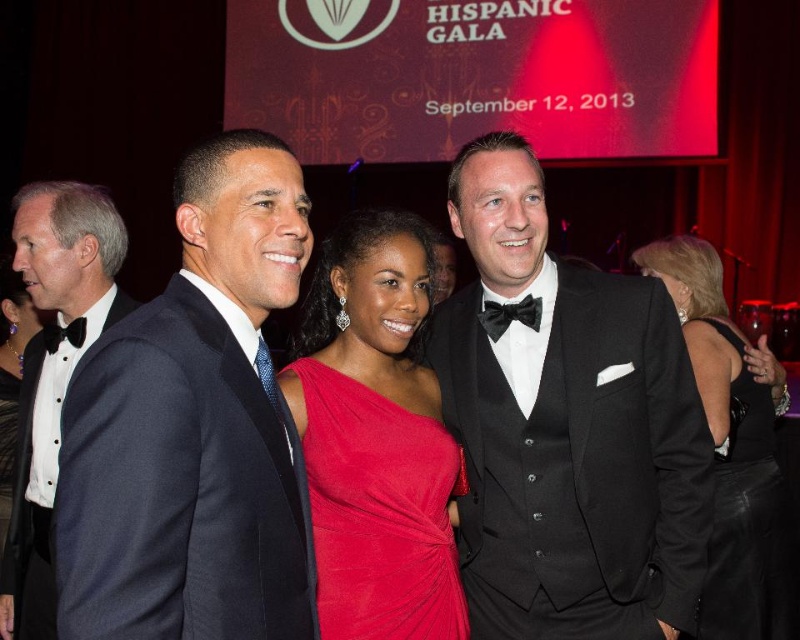
Which is above, velvet black dress at center or matte black bow tie at left?

Positioned higher is matte black bow tie at left.

Is point (780, 413) positioned before point (44, 333)?

No.

The image size is (800, 640). What do you see at coordinates (732, 445) in the screenshot? I see `velvet black dress at center` at bounding box center [732, 445].

You are a GUI agent. You are given a task and a screenshot of the screen. Output one action in this format:
    pyautogui.click(x=<x>, y=<y>)
    Task: Click on the velvet black dress at center
    The image size is (800, 640).
    Given the screenshot: What is the action you would take?
    pyautogui.click(x=732, y=445)

Looking at this image, who is positioned more to the right, satin red dress at center or matte black bow tie at left?

satin red dress at center

At what (x,y) coordinates should I click in order to perform the action: click on satin red dress at center. Please return your answer as a coordinate pair (x, y). The height and width of the screenshot is (640, 800). Looking at the image, I should click on (376, 438).

This screenshot has width=800, height=640. In order to click on satin red dress at center in this screenshot , I will do `click(376, 438)`.

Who is lower down, black satin tuxedo at center or matte black bow tie at left?

black satin tuxedo at center

Is black satin tuxedo at center closer to camera compared to matte black bow tie at left?

Yes, black satin tuxedo at center is in front of matte black bow tie at left.

Does point (536, 497) come closer to viewer compared to point (76, 324)?

Yes, it is.

Locate an element on the screen. Image resolution: width=800 pixels, height=640 pixels. black satin tuxedo at center is located at coordinates (566, 428).